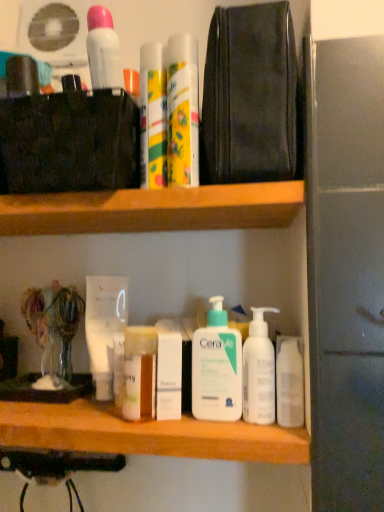
The image size is (384, 512). I want to click on vacant space positioned to the left of translucent plastic jar at center, the 2th toiletry in the bottom-to-top sequence, so [59, 416].